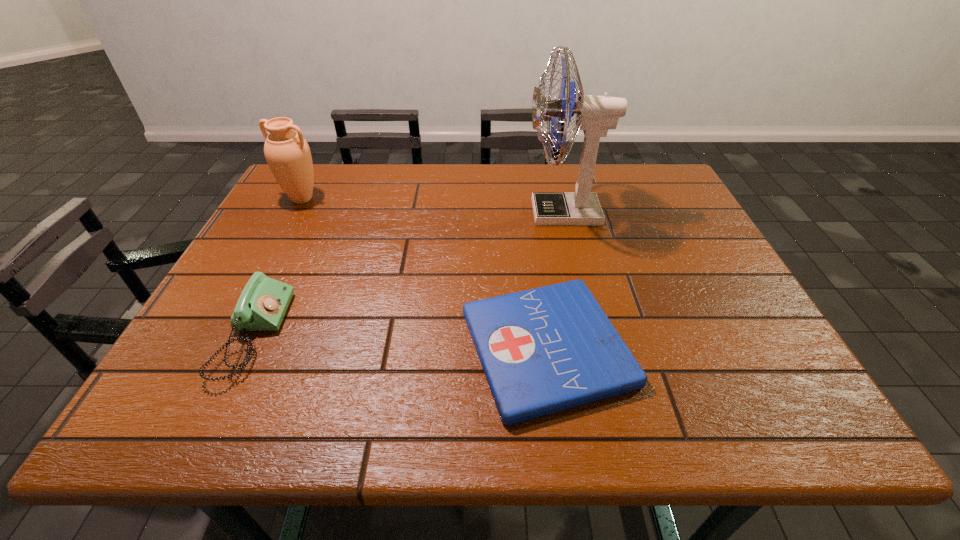
The image size is (960, 540). I want to click on fan at the far edge, so click(595, 115).

The width and height of the screenshot is (960, 540). In order to click on urn at the far edge in this screenshot , I will do `click(287, 153)`.

Image resolution: width=960 pixels, height=540 pixels. I want to click on telephone present at the near edge, so click(262, 305).

The image size is (960, 540). I want to click on the first-aid kit that is at the near edge, so click(x=547, y=349).

Where is `urn that is at the left edge`? The image size is (960, 540). urn that is at the left edge is located at coordinates (287, 153).

Identify the location of telephone at the left edge. 262,305.

Locate an element on the screen. This screenshot has width=960, height=540. object that is at the far left corner is located at coordinates (287, 153).

Image resolution: width=960 pixels, height=540 pixels. Identify the location of object located in the near left corner section of the desktop. (262, 305).

Where is `vacant space at the far edge of the desktop`? The height and width of the screenshot is (540, 960). vacant space at the far edge of the desktop is located at coordinates (510, 172).

Where is `vacant space at the near edge of the desktop`? The height and width of the screenshot is (540, 960). vacant space at the near edge of the desktop is located at coordinates pyautogui.click(x=673, y=413).